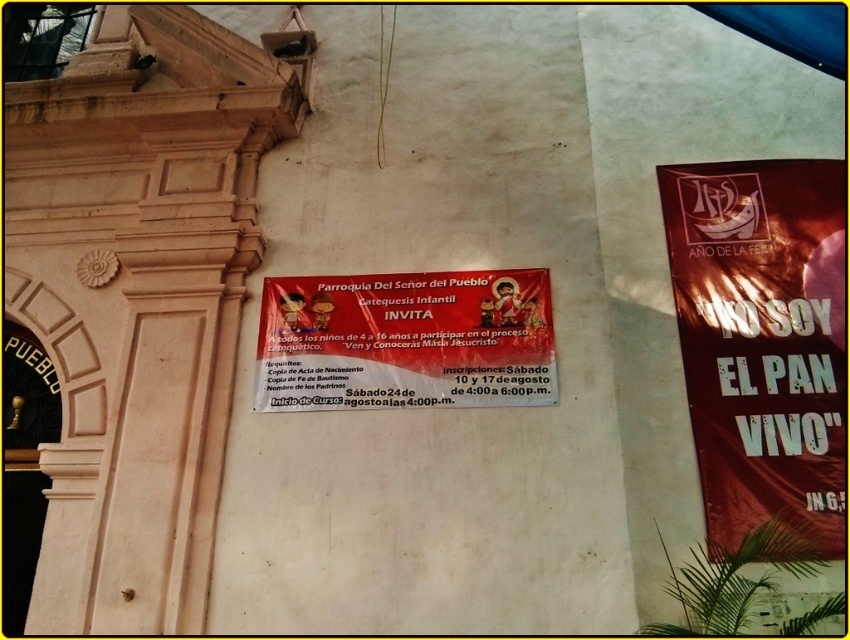
Who is more distant from viewer, [718,196] or [318,365]?

The point [718,196] is more distant.

Who is more forward, (710, 474) or (548, 328)?

Point (710, 474) is more forward.

Where is `metallic gold banner at right`? The height and width of the screenshot is (640, 850). metallic gold banner at right is located at coordinates (762, 339).